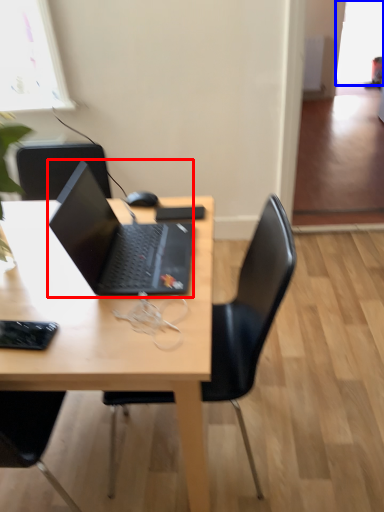
Question: Among these objects, which one is farthest to the camera, laptop (highlighted by a red box) or window screen (highlighted by a blue box)?

Choices:
 (A) laptop
 (B) window screen

Answer: (B)